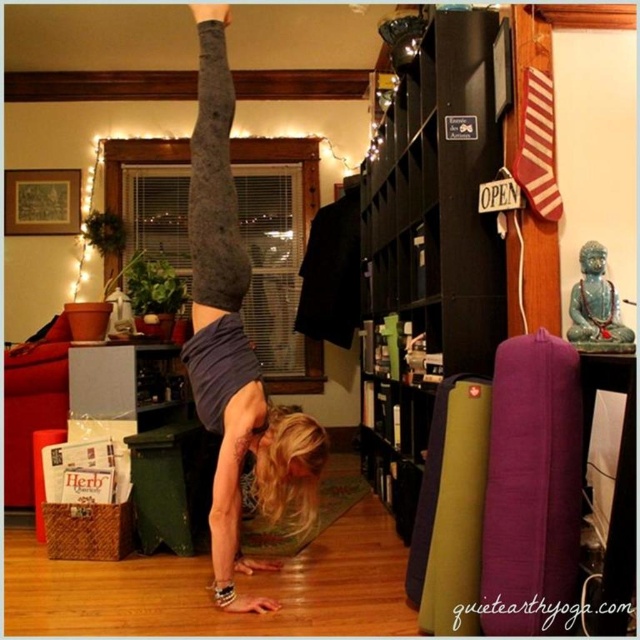
You are a delivery robot that needs to place a package between the black wood bookshelf at center and the matte gray leggings at center. The package requires 36 inches of space. Is there enough space between them?

The black wood bookshelf at center and matte gray leggings at center are 33.85 inches apart from each other, which is less than the required 36 inches. Therefore, there isn not enough space to place the package between them.

You are a delivery person entering the room and need to place a package on the tallest object at center. Which object should you choose between the black wood bookshelf at center and the matte gray leggings at center?

The matte gray leggings at center are taller than the black wood bookshelf at center, so you should place the package on the matte gray leggings at center.